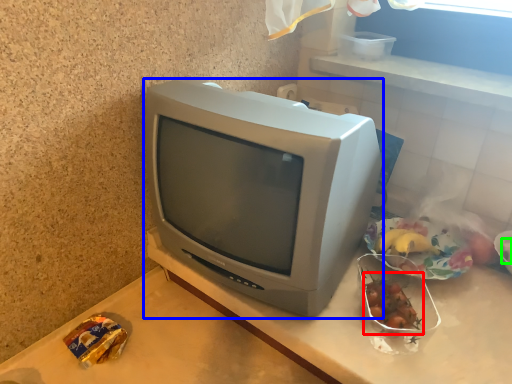
Question: Which object is the farthest from food (highlighted by a red box)? Choose among these: television (highlighted by a blue box) or food (highlighted by a green box).

Choices:
 (A) television
 (B) food

Answer: (B)